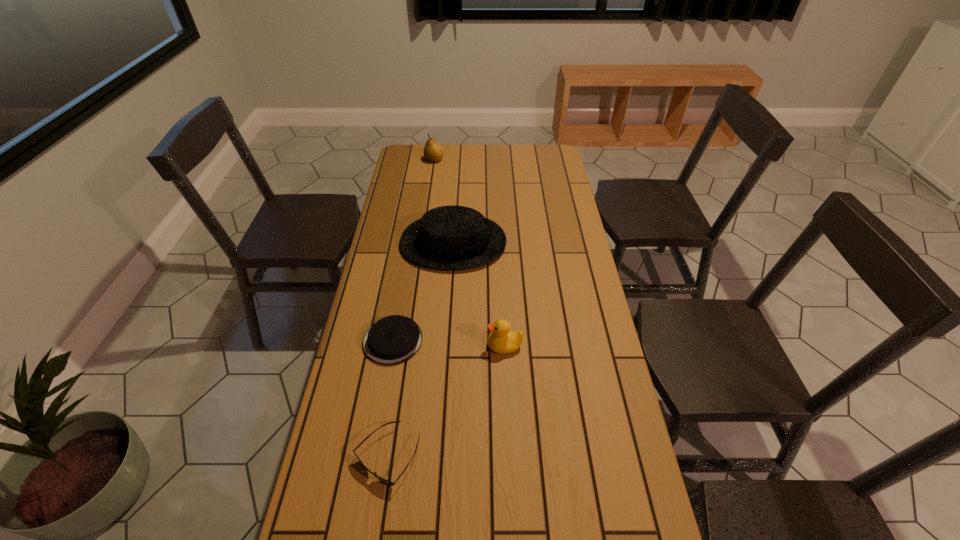
Find the location of a particular element. The height and width of the screenshot is (540, 960). the farthest object is located at coordinates (433, 152).

Image resolution: width=960 pixels, height=540 pixels. In order to click on fedora in this screenshot , I will do `click(452, 237)`.

Where is `duck`? The image size is (960, 540). duck is located at coordinates (501, 340).

What are the coordinates of `the second shortest object` in the screenshot? It's located at (393, 339).

At what (x,y) coordinates should I click in order to perform the action: click on sunglasses. Please return your answer as a coordinate pair (x, y). The height and width of the screenshot is (540, 960). Looking at the image, I should click on (381, 479).

This screenshot has width=960, height=540. What are the coordinates of `the nearest object` in the screenshot? It's located at (381, 479).

Where is `free spot located on the front of the farthest object`? The height and width of the screenshot is (540, 960). free spot located on the front of the farthest object is located at coordinates (431, 179).

Image resolution: width=960 pixels, height=540 pixels. What are the coordinates of `vacant space located on the front of the second farthest object` in the screenshot? It's located at (448, 318).

Where is `free spot located at the beak of the duck`? free spot located at the beak of the duck is located at coordinates (376, 346).

Image resolution: width=960 pixels, height=540 pixels. Identify the location of vacant space located 0.130m at the beak of the duck. (444, 346).